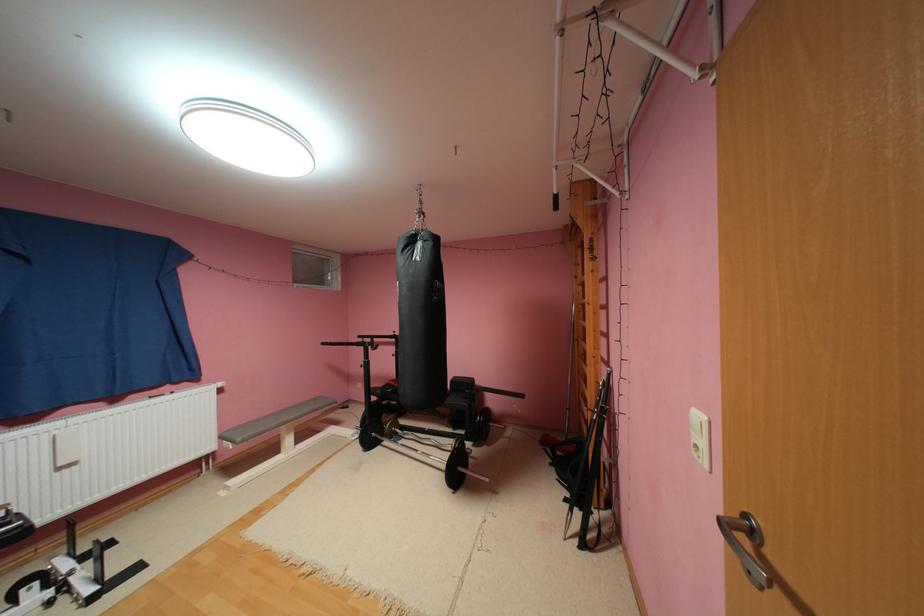
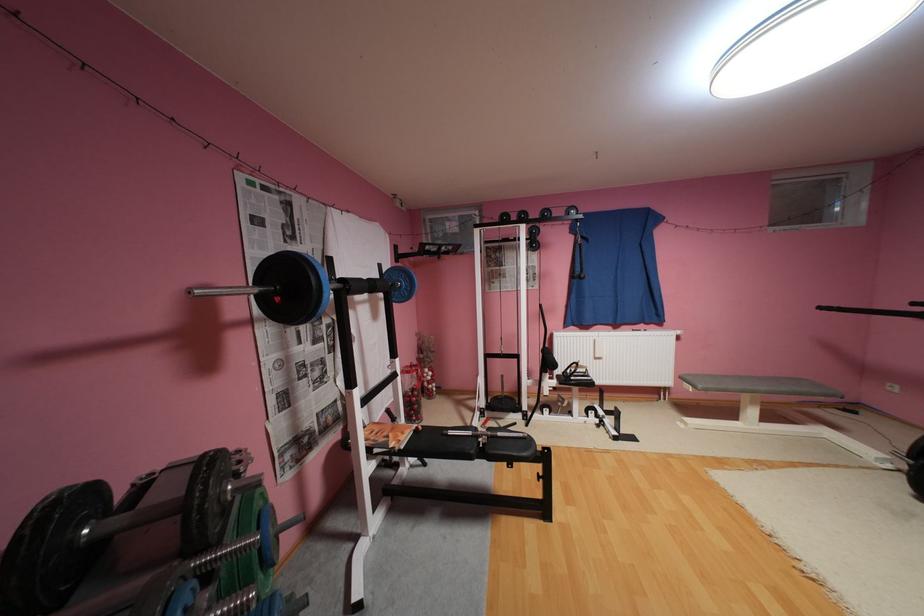
The point at (300, 416) is marked in the first image. Where is the corresponding point in the second image?

(771, 387)